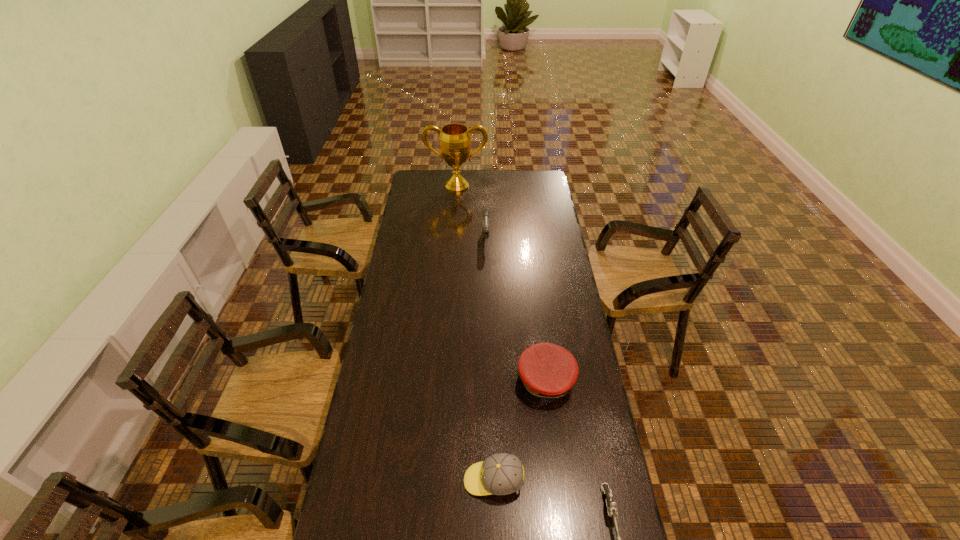
Locate which object ranks in proximity to the left gun. Please provide its 2D coordinates. Your answer should be formatted as a tuple, i.e. [(x, y)], where the tuple contains the x and y coordinates of a point satisfying the conditions above.

[(455, 143)]